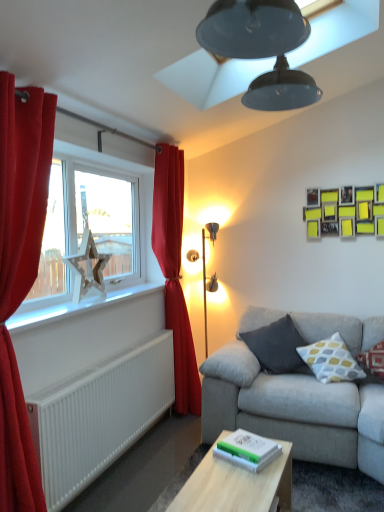
Question: Is matte black lampshade at upper center shorter than dark gray cushion at center, the third pillow when ordered from right to left?

Choices:
 (A) no
 (B) yes

Answer: (A)

Question: From a real-world perspective, is matte black lampshade at upper center located beneath dark gray cushion at center, the third pillow when ordered from right to left?

Choices:
 (A) no
 (B) yes

Answer: (A)

Question: Can you confirm if matte black lampshade at upper center is positioned to the right of dark gray cushion at center, which ranks as the 1th pillow in left-to-right order?

Choices:
 (A) yes
 (B) no

Answer: (B)

Question: Could you tell me if matte black lampshade at upper center is turned towards dark gray cushion at center, which ranks as the 1th pillow in left-to-right order?

Choices:
 (A) yes
 (B) no

Answer: (B)

Question: Is matte black lampshade at upper center taller than dark gray cushion at center, which ranks as the 1th pillow in left-to-right order?

Choices:
 (A) no
 (B) yes

Answer: (B)

Question: From the image's perspective, is matte black lampshade at upper center located above dark gray cushion at center, which ranks as the 1th pillow in left-to-right order?

Choices:
 (A) no
 (B) yes

Answer: (B)

Question: Is light wood rectangular table at center positioned in front of dark gray cushion at center, the third pillow when ordered from right to left?

Choices:
 (A) no
 (B) yes

Answer: (B)

Question: Is light wood rectangular table at center bigger than dark gray cushion at center, which ranks as the 1th pillow in left-to-right order?

Choices:
 (A) no
 (B) yes

Answer: (B)

Question: Is there a large distance between light wood rectangular table at center and dark gray cushion at center, which ranks as the 1th pillow in left-to-right order?

Choices:
 (A) no
 (B) yes

Answer: (B)

Question: Does light wood rectangular table at center have a lesser height compared to dark gray cushion at center, the third pillow when ordered from right to left?

Choices:
 (A) no
 (B) yes

Answer: (B)

Question: Considering the relative positions of light wood rectangular table at center and dark gray cushion at center, which ranks as the 1th pillow in left-to-right order, in the image provided, is light wood rectangular table at center to the left of dark gray cushion at center, which ranks as the 1th pillow in left-to-right order, from the viewer's perspective?

Choices:
 (A) no
 (B) yes

Answer: (B)

Question: From the image's perspective, is light wood rectangular table at center over dark gray cushion at center, which ranks as the 1th pillow in left-to-right order?

Choices:
 (A) yes
 (B) no

Answer: (B)

Question: Is white plastic window sill at left at the back of velvet red curtain at left, the second curtain viewed from the back?

Choices:
 (A) no
 (B) yes

Answer: (A)